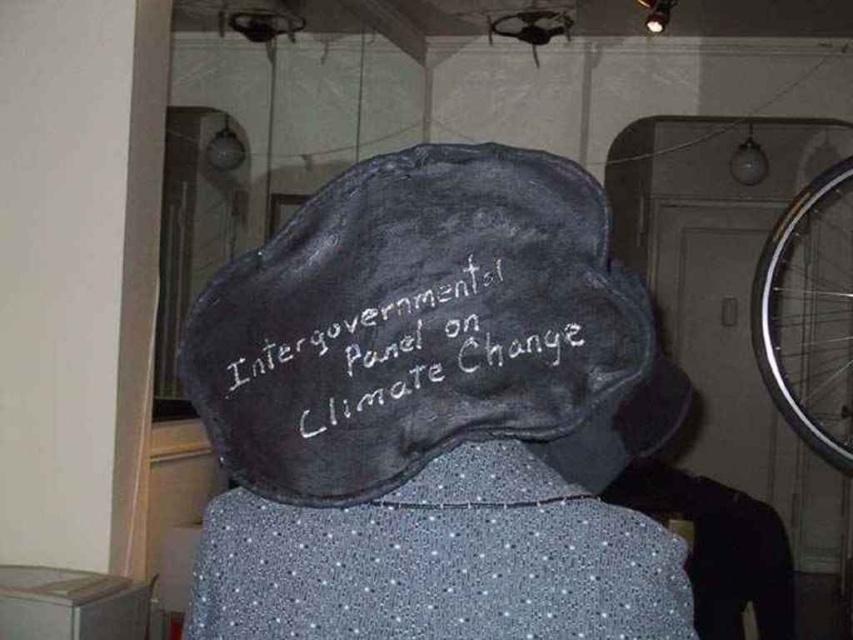
Does dark gray felt baseball hat at center have a greater width compared to black chalkboard at center?

Correct, the width of dark gray felt baseball hat at center exceeds that of black chalkboard at center.

The width and height of the screenshot is (853, 640). Describe the element at coordinates (428, 330) in the screenshot. I see `dark gray felt baseball hat at center` at that location.

Which is in front, point (474, 180) or point (521, 317)?

Point (521, 317)

Identify the location of dark gray felt baseball hat at center. The height and width of the screenshot is (640, 853). (428, 330).

Which is more to the right, black chalkboard at center or silver metallic bicycle wheel at right?

From the viewer's perspective, silver metallic bicycle wheel at right appears more on the right side.

Which is above, black chalkboard at center or silver metallic bicycle wheel at right?

silver metallic bicycle wheel at right is higher up.

Which is behind, point (550, 368) or point (759, 358)?

The point (759, 358) is more distant.

This screenshot has width=853, height=640. Find the location of `black chalkboard at center`. black chalkboard at center is located at coordinates (403, 344).

Is dark gray felt baseball hat at center taller than silver metallic bicycle wheel at right?

Incorrect, dark gray felt baseball hat at center's height is not larger of silver metallic bicycle wheel at right's.

Between dark gray felt baseball hat at center and silver metallic bicycle wheel at right, which one is positioned higher?

silver metallic bicycle wheel at right is higher up.

Does point (514, 364) come closer to viewer compared to point (822, 452)?

Yes, point (514, 364) is closer to viewer.

In order to click on dark gray felt baseball hat at center in this screenshot , I will do `click(428, 330)`.